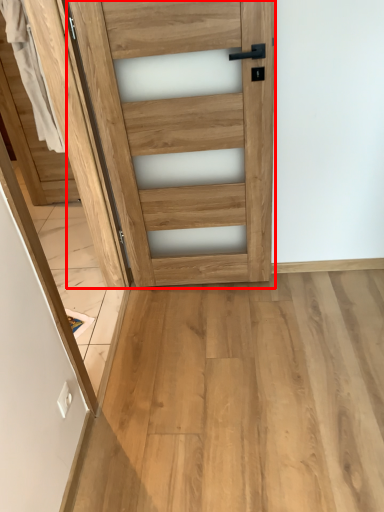
Question: From the image's perspective, where is door (annotated by the red box) located relative to screen door?

Choices:
 (A) above
 (B) below

Answer: (A)